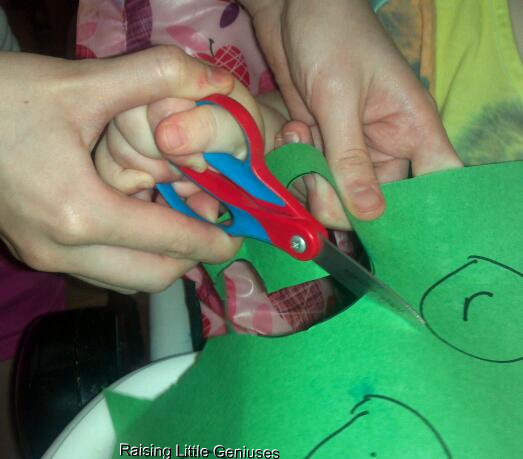
You are a GUI agent. You are given a task and a screenshot of the screen. Output one action in this format:
    pyautogui.click(x=<x>, y=<y>)
    Task: Click on the red scissors
    
    Given the screenshot: What is the action you would take?
    pyautogui.click(x=283, y=214)